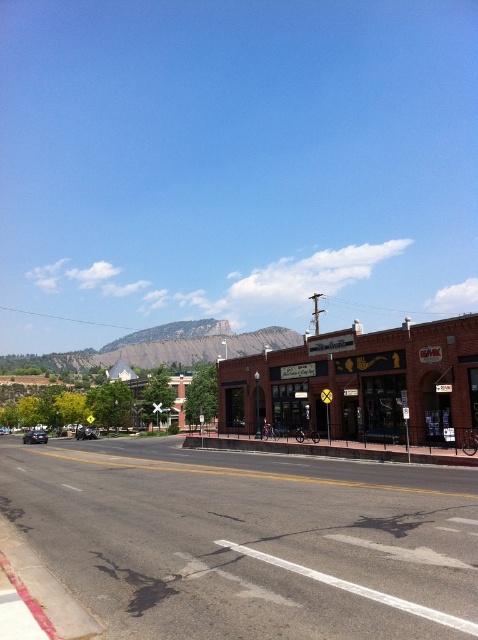
Question: Where is brown brick building at center located in relation to shiny black sedan at left in the image?

Choices:
 (A) left
 (B) right

Answer: (A)

Question: Which point is farther from the camera taking this photo?

Choices:
 (A) (73, 413)
 (B) (358, 371)
 (C) (28, 433)

Answer: (C)

Question: Does brick building at center have a greater width compared to shiny black sedan at left?

Choices:
 (A) no
 (B) yes

Answer: (B)

Question: Estimate the real-world distances between objects in this image. Which object is closer to the shiny black sedan at left?

Choices:
 (A) brown brick building at center
 (B) shiny black sedan at center

Answer: (B)

Question: Is brown brick building at center in front of shiny black sedan at center?

Choices:
 (A) yes
 (B) no

Answer: (B)

Question: Which of these objects is positioned closest to the brick building at center?

Choices:
 (A) shiny black sedan at left
 (B) shiny black sedan at center

Answer: (A)